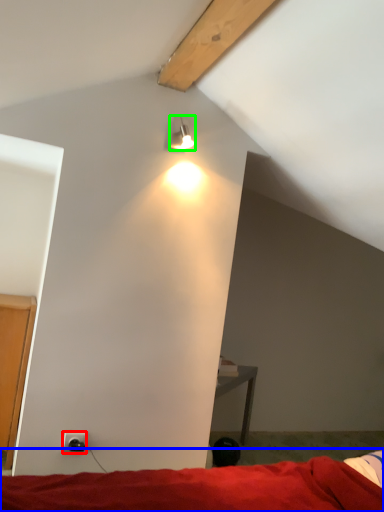
Question: Which is farther away from power outlet (highlighted by a red box)? bed (highlighted by a blue box) or lamp (highlighted by a green box)?

Choices:
 (A) bed
 (B) lamp

Answer: (B)